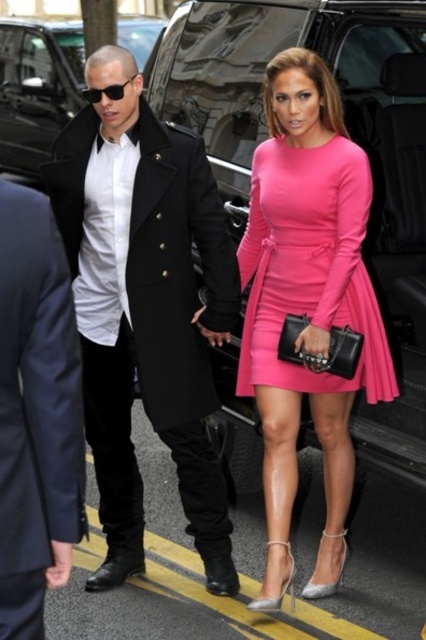
Question: Which point appears farthest from the camera in this image?

Choices:
 (A) (417, 401)
 (B) (353, 400)

Answer: (A)

Question: From the image, what is the correct spatial relationship of matte black coat at left in relation to dark blue wool suit at center?

Choices:
 (A) left
 (B) right

Answer: (B)

Question: Can you confirm if black leather limo at center is bigger than matte pink dress at center?

Choices:
 (A) no
 (B) yes

Answer: (B)

Question: Which point is farther to the camera?

Choices:
 (A) (342, 275)
 (B) (267, 548)

Answer: (B)

Question: Which is farther from the matte pink dress at center?

Choices:
 (A) pink satin dress at center
 (B) matte black coat at left
 (C) dark blue wool suit at center

Answer: (C)

Question: Considering the relative positions of matte black coat at left and pink satin dress at center in the image provided, where is matte black coat at left located with respect to pink satin dress at center?

Choices:
 (A) left
 (B) right

Answer: (A)